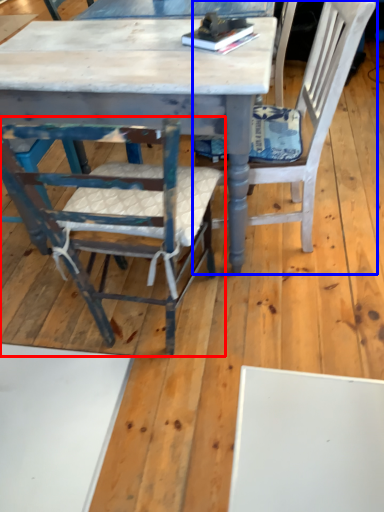
Question: Which of the following is the closest to the observer, chair (highlighted by a red box) or chair (highlighted by a blue box)?

Choices:
 (A) chair
 (B) chair

Answer: (A)